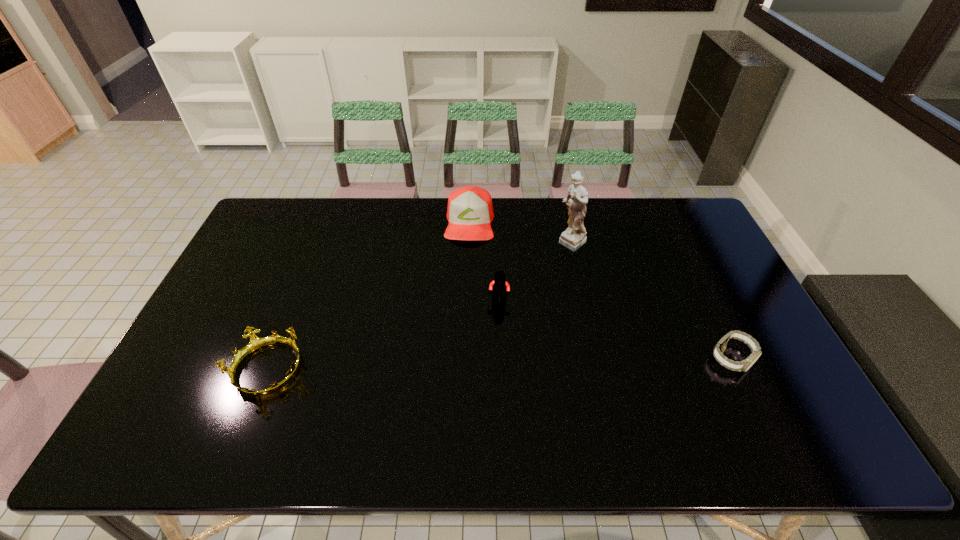
This screenshot has height=540, width=960. What are the coordinates of `crown` in the screenshot? It's located at (256, 343).

Identify the location of watch. (744, 365).

You are a GUI agent. You are given a task and a screenshot of the screen. Output one action in this format:
    pyautogui.click(x=<x>, y=<y>)
    Task: Click on the Lego
    This screenshot has height=540, width=960.
    Given the screenshot: What is the action you would take?
    pyautogui.click(x=499, y=286)

This screenshot has width=960, height=540. Find the location of `baseball cap`. baseball cap is located at coordinates point(470,211).

I want to click on the tallest object, so click(x=574, y=236).

The image size is (960, 540). What are the coordinates of `figurine` in the screenshot? It's located at (574, 236).

What are the coordinates of `blank area located 0.210m on the right of the crown` in the screenshot? It's located at (385, 370).

At what (x,y) coordinates should I click in order to perform the action: click on blank space located 0.220m on the front-facing side of the Lego. Please return your answer as a coordinate pair (x, y). Looking at the image, I should click on [485, 369].

Locate an element on the screen. This screenshot has height=540, width=960. vacant region located on the front-facing side of the Lego is located at coordinates (491, 339).

Where is `vacant space located on the front-facing side of the Lego`? vacant space located on the front-facing side of the Lego is located at coordinates (481, 386).